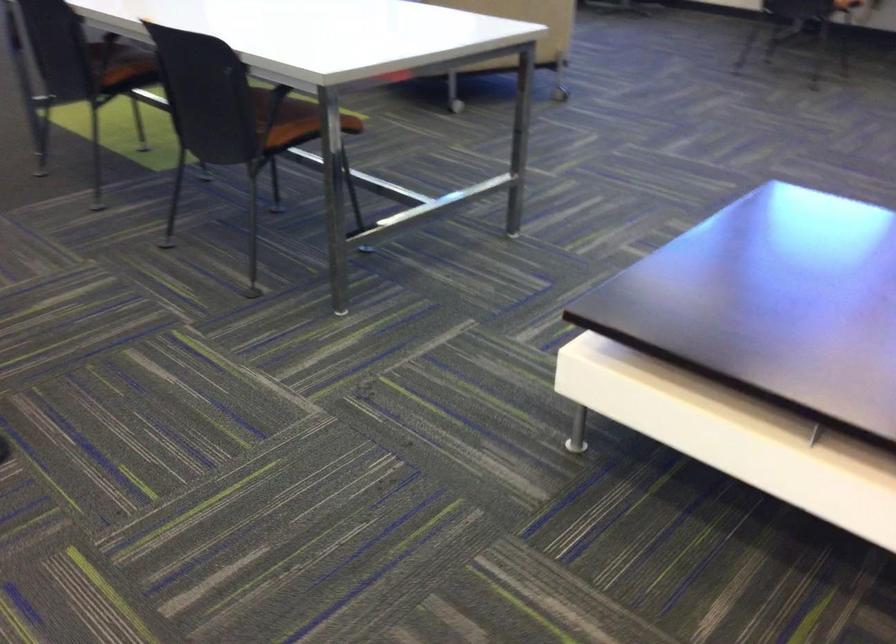
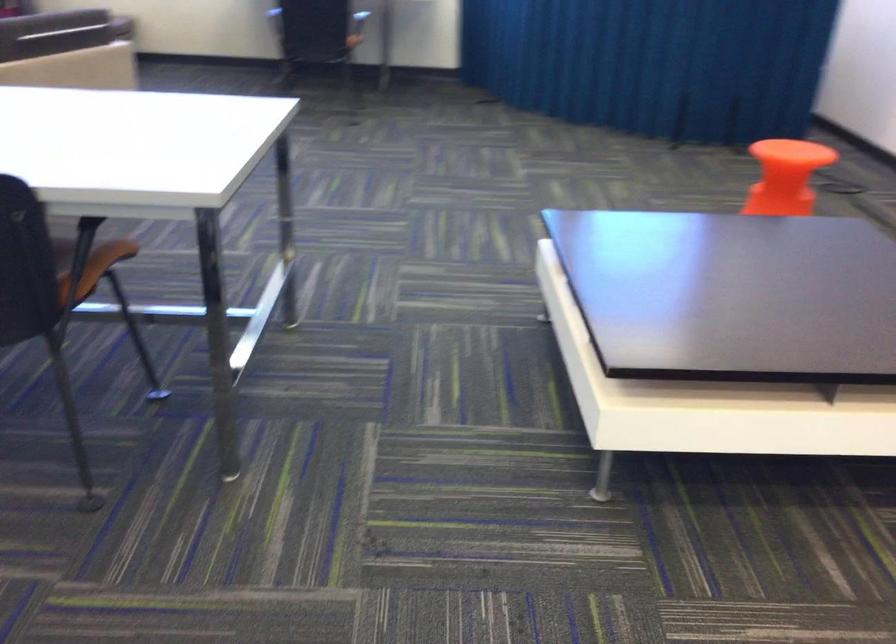
Find the pixel in the second image that matches point (300, 114) in the first image.

(62, 252)